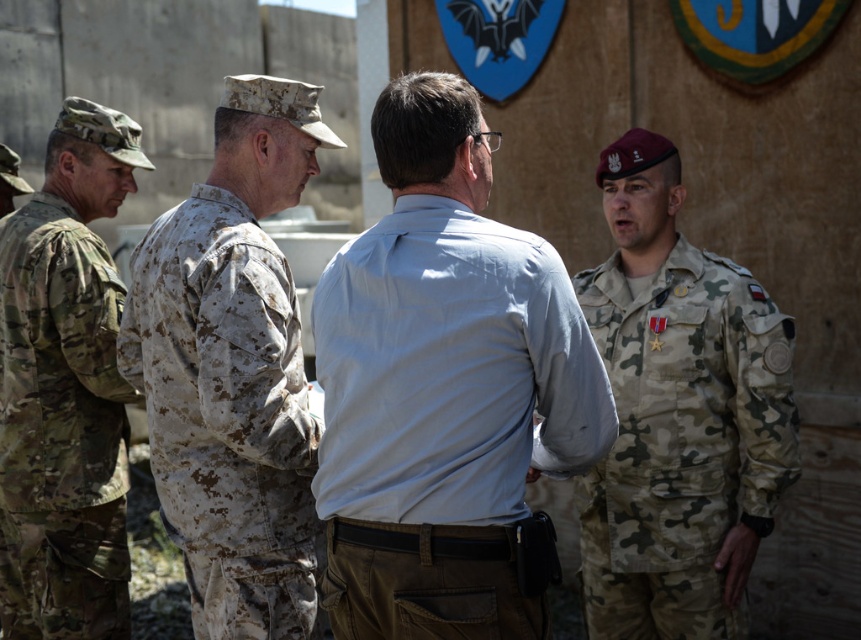
Measure the distance from camouflage uniform at right to camouflage uniform at left.

The distance of camouflage uniform at right from camouflage uniform at left is 6.43 feet.

From the picture: Does camouflage uniform at right appear over camouflage uniform at left?

Yes.

Locate an element on the screen. camouflage uniform at right is located at coordinates (678, 413).

Find the location of `camouflage uniform at right`. camouflage uniform at right is located at coordinates (678, 413).

Does light blue cotton shirt at center appear on the left side of camouflage uniform at center?

In fact, light blue cotton shirt at center is to the right of camouflage uniform at center.

Can you confirm if light blue cotton shirt at center is thinner than camouflage uniform at center?

No, light blue cotton shirt at center is not thinner than camouflage uniform at center.

Who is more forward, [516,403] or [223,400]?

Point [516,403]

The width and height of the screenshot is (861, 640). I want to click on light blue cotton shirt at center, so click(443, 387).

Which is behind, point (449, 141) or point (745, 490)?

Point (745, 490)

Is light blue cotton shirt at center taller than camouflage uniform at right?

No.

The width and height of the screenshot is (861, 640). I want to click on light blue cotton shirt at center, so click(x=443, y=387).